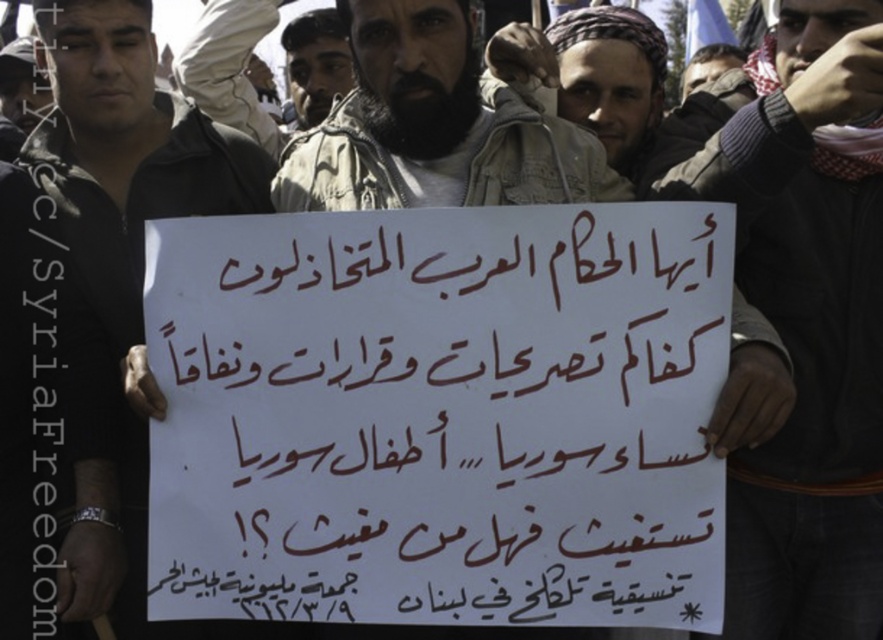
Who is higher up, dark gray sweater at center or white paper sign at center?

white paper sign at center is higher up.

Is dark gray sweater at center below white paper sign at center?

Correct, dark gray sweater at center is located below white paper sign at center.

Is point (819, 372) in front of point (40, 163)?

Yes, point (819, 372) is closer to viewer.

Where is `dark gray sweater at center`? This screenshot has height=640, width=883. dark gray sweater at center is located at coordinates (801, 312).

Does dark gray sweater at center appear on the right side of beige textured jacket at center?

Correct, you'll find dark gray sweater at center to the right of beige textured jacket at center.

Is dark gray sweater at center wider than beige textured jacket at center?

In fact, dark gray sweater at center might be narrower than beige textured jacket at center.

This screenshot has height=640, width=883. In order to click on dark gray sweater at center in this screenshot , I will do `click(801, 312)`.

This screenshot has height=640, width=883. I want to click on dark gray sweater at center, so click(x=801, y=312).

Is white paper sign at center positioned at the back of bearded man at center?

No.

Which of these two, white paper sign at center or bearded man at center, stands taller?

white paper sign at center is taller.

Is point (137, 164) positioned before point (235, 104)?

Yes, point (137, 164) is closer to viewer.

Locate an element on the screen. The image size is (883, 640). white paper sign at center is located at coordinates (126, 154).